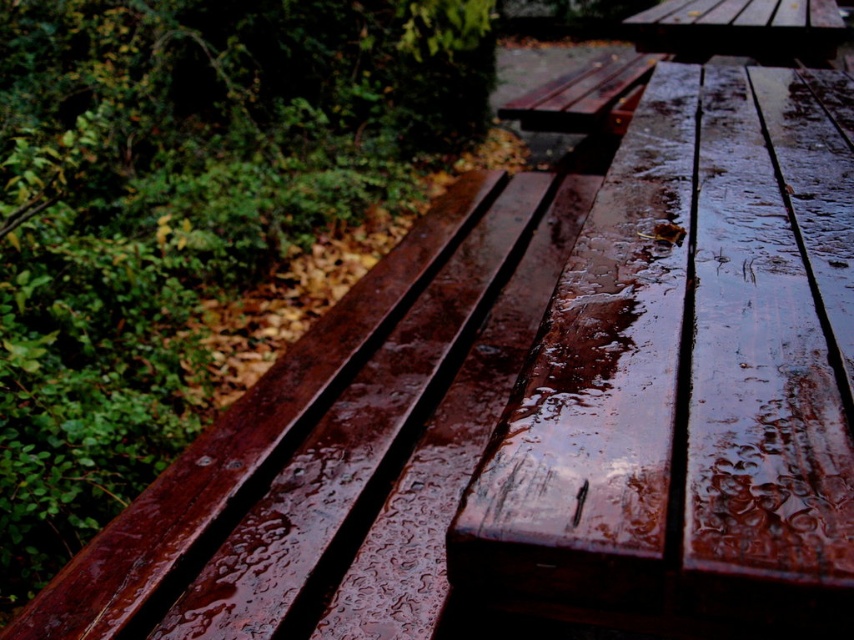
Question: Which object appears closest to the camera in this image?

Choices:
 (A) wet wood picnic table at upper center
 (B) wet wood plank at center
 (C) glossy wood bench at left

Answer: (B)

Question: Does glossy wood bench at left appear on the left side of wet wood picnic table at upper center?

Choices:
 (A) yes
 (B) no

Answer: (A)

Question: Estimate the real-world distances between objects in this image. Which object is closer to the glossy wood bench at left?

Choices:
 (A) wet wood picnic table at upper center
 (B) wet wood plank at center

Answer: (B)

Question: From the image, what is the correct spatial relationship of glossy wood bench at left in relation to wet wood plank at center?

Choices:
 (A) below
 (B) above

Answer: (B)

Question: Is glossy wood bench at left above wet wood picnic table at upper center?

Choices:
 (A) no
 (B) yes

Answer: (A)

Question: Among these objects, which one is nearest to the camera?

Choices:
 (A) glossy wood bench at left
 (B) wet wood picnic table at upper center
 (C) wet wood plank at center

Answer: (C)